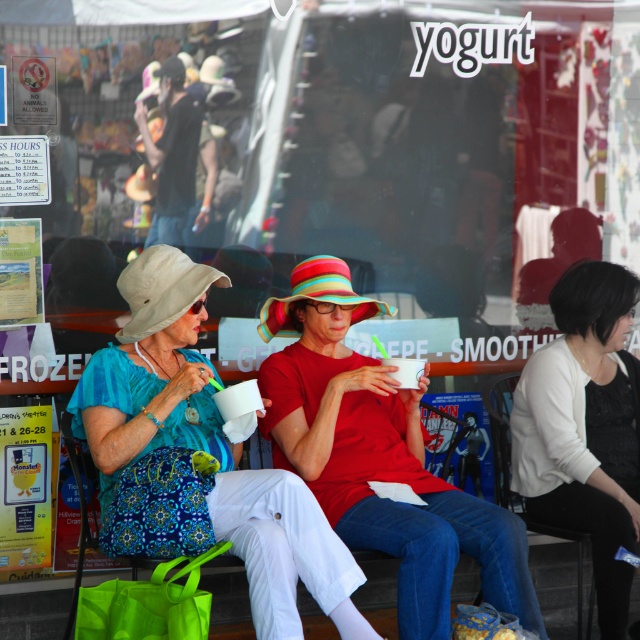
Question: Which object appears closest to the camera in this image?

Choices:
 (A) white matte sweater at upper right
 (B) matte red shirt at center

Answer: (B)

Question: Does matte red shirt at center have a smaller size compared to white matte sweater at upper right?

Choices:
 (A) no
 (B) yes

Answer: (A)

Question: Which of the following is the farthest from the observer?

Choices:
 (A) (284, 410)
 (B) (138, 387)
 (C) (570, 500)

Answer: (C)

Question: Is matte blue dress at center further to the viewer compared to matte red shirt at center?

Choices:
 (A) yes
 (B) no

Answer: (B)

Question: Which point is closer to the camera taking this photo?

Choices:
 (A) (200, 433)
 (B) (620, 413)
 (C) (317, 445)

Answer: (A)

Question: Is matte red shirt at center wider than white matte sweater at upper right?

Choices:
 (A) no
 (B) yes

Answer: (B)